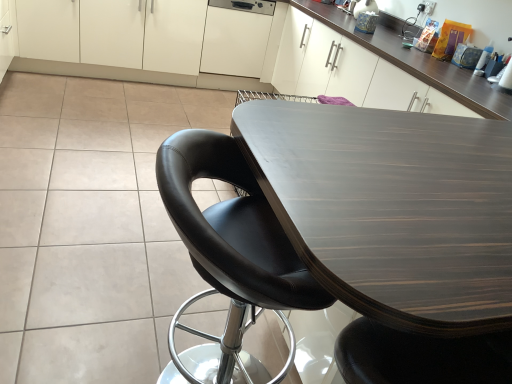
Question: From the image's perspective, is white glossy cabinets at upper center, the second cabinetry in the right-to-left sequence, on white matte cabinet at center, which is counted as the second cabinetry, starting from the left?

Choices:
 (A) no
 (B) yes

Answer: (B)

Question: Can you confirm if white glossy cabinets at upper center, which is the first cabinetry in left-to-right order, is smaller than white matte cabinet at center, the 1th cabinetry when ordered from right to left?

Choices:
 (A) no
 (B) yes

Answer: (A)

Question: Is white glossy cabinets at upper center, the second cabinetry in the right-to-left sequence, taller than white matte cabinet at center, the 1th cabinetry when ordered from right to left?

Choices:
 (A) no
 (B) yes

Answer: (B)

Question: Are white glossy cabinets at upper center, which is the first cabinetry in left-to-right order, and white matte cabinet at center, the 1th cabinetry when ordered from right to left, far apart?

Choices:
 (A) yes
 (B) no

Answer: (B)

Question: Considering the relative positions of white glossy cabinets at upper center, the second cabinetry in the right-to-left sequence, and white matte cabinet at center, which is counted as the second cabinetry, starting from the left, in the image provided, is white glossy cabinets at upper center, the second cabinetry in the right-to-left sequence, to the left of white matte cabinet at center, which is counted as the second cabinetry, starting from the left, from the viewer's perspective?

Choices:
 (A) yes
 (B) no

Answer: (A)

Question: Considering the relative sizes of white glossy cabinets at upper center, which is the first cabinetry in left-to-right order, and white matte cabinet at center, which is counted as the second cabinetry, starting from the left, in the image provided, is white glossy cabinets at upper center, which is the first cabinetry in left-to-right order, shorter than white matte cabinet at center, which is counted as the second cabinetry, starting from the left,?

Choices:
 (A) yes
 (B) no

Answer: (B)

Question: Considering the relative sizes of white glossy cabinets at upper center, which is the first cabinetry in left-to-right order, and black leather chair at center in the image provided, is white glossy cabinets at upper center, which is the first cabinetry in left-to-right order, smaller than black leather chair at center?

Choices:
 (A) no
 (B) yes

Answer: (A)

Question: Is white glossy cabinets at upper center, the second cabinetry in the right-to-left sequence, thinner than black leather chair at center?

Choices:
 (A) yes
 (B) no

Answer: (B)

Question: From the image's perspective, would you say white glossy cabinets at upper center, which is the first cabinetry in left-to-right order, is positioned over black leather chair at center?

Choices:
 (A) no
 (B) yes

Answer: (B)

Question: Is white glossy cabinets at upper center, the second cabinetry in the right-to-left sequence, beside black leather chair at center?

Choices:
 (A) no
 (B) yes

Answer: (A)

Question: Is white glossy cabinets at upper center, the second cabinetry in the right-to-left sequence, bigger than black leather chair at center?

Choices:
 (A) no
 (B) yes

Answer: (B)

Question: Could you tell me if white glossy cabinets at upper center, the second cabinetry in the right-to-left sequence, is facing black leather chair at center?

Choices:
 (A) yes
 (B) no

Answer: (A)

Question: Is white matte cabinet at center, which is counted as the second cabinetry, starting from the left, facing towards dark wood table at center?

Choices:
 (A) no
 (B) yes

Answer: (B)